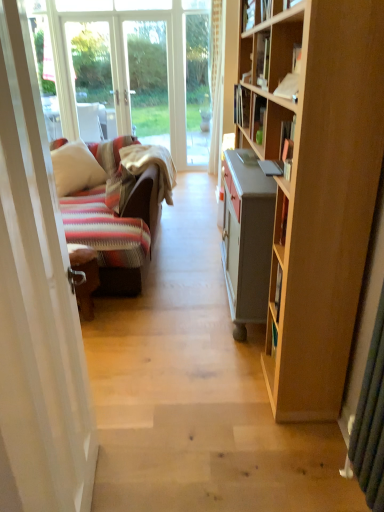
Where is `matte black book at upper center, which is the 1th book from front to back`? matte black book at upper center, which is the 1th book from front to back is located at coordinates (262, 59).

At what (x,y) coordinates should I click in order to perform the action: click on hardcover book at upper right, the 1th book positioned from the back. Please return your answer as a coordinate pair (x, y). Looking at the image, I should click on (241, 106).

What do you see at coordinates (75, 168) in the screenshot? Image resolution: width=384 pixels, height=512 pixels. I see `white soft pillow at left, marked as the second pillow in a right-to-left arrangement` at bounding box center [75, 168].

This screenshot has width=384, height=512. In order to click on white glossy door at left in this screenshot , I will do `click(37, 306)`.

From the image's perspective, is striped fabric pillow at left, which appears as the 1th pillow when viewed from the right, over matte black book at upper center, which is the 1th book from front to back?

Incorrect, from the image's perspective, striped fabric pillow at left, which appears as the 1th pillow when viewed from the right, is lower than matte black book at upper center, which is the 1th book from front to back.

Is striped fabric pillow at left, which appears as the 1th pillow when viewed from the right, spatially inside matte black book at upper center, which is the 1th book from front to back, or outside of it?

striped fabric pillow at left, which appears as the 1th pillow when viewed from the right, cannot be found inside matte black book at upper center, which is the 1th book from front to back.

In the image, is striped fabric pillow at left, acting as the second pillow starting from the left, positioned in front of or behind matte black book at upper center, which is the 1th book from front to back?

Visually, striped fabric pillow at left, acting as the second pillow starting from the left, is located behind matte black book at upper center, which is the 1th book from front to back.

Is striped fabric pillow at left, acting as the second pillow starting from the left, directly adjacent to matte black book at upper center, which is the 1th book from front to back?

striped fabric pillow at left, acting as the second pillow starting from the left, and matte black book at upper center, which is the 1th book from front to back, are not in contact.

Does white glossy door at left have a larger size compared to white soft pillow at left, marked as the second pillow in a right-to-left arrangement?

Actually, white glossy door at left might be smaller than white soft pillow at left, marked as the second pillow in a right-to-left arrangement.

From a real-world perspective, is white glossy door at left physically below white soft pillow at left, marked as the second pillow in a right-to-left arrangement?

Incorrect, from a real-world perspective, white glossy door at left is higher than white soft pillow at left, marked as the second pillow in a right-to-left arrangement.

Find the location of `the 2nd pillow behind when counting from the white glossy door at left`. the 2nd pillow behind when counting from the white glossy door at left is located at coordinates (75, 168).

Considering the relative sizes of white glossy door at left and white soft pillow at left, marked as the second pillow in a right-to-left arrangement, in the image provided, is white glossy door at left shorter than white soft pillow at left, marked as the second pillow in a right-to-left arrangement,?

Incorrect, the height of white glossy door at left does not fall short of that of white soft pillow at left, marked as the second pillow in a right-to-left arrangement.

Considering the positions of points (256, 48) and (235, 98), is point (256, 48) farther from camera compared to point (235, 98)?

No, it is not.

Is matte black book at upper center, positioned as the second book in back-to-front order, aimed at hardcover book at upper right, the 1th book positioned from the back?

No, matte black book at upper center, positioned as the second book in back-to-front order, does not turn towards hardcover book at upper right, the 1th book positioned from the back.

The width and height of the screenshot is (384, 512). Identify the location of book behind the matte black book at upper center, positioned as the second book in back-to-front order. (241, 106).

Is white glossy door at left inside striped fabric pillow at left, acting as the second pillow starting from the left?

No, white glossy door at left is not a part of striped fabric pillow at left, acting as the second pillow starting from the left.

In terms of height, does striped fabric pillow at left, which appears as the 1th pillow when viewed from the right, look taller or shorter compared to white glossy door at left?

Considering their sizes, striped fabric pillow at left, which appears as the 1th pillow when viewed from the right, has less height than white glossy door at left.

Can you confirm if striped fabric pillow at left, which appears as the 1th pillow when viewed from the right, is bigger than white glossy door at left?

No, striped fabric pillow at left, which appears as the 1th pillow when viewed from the right, is not bigger than white glossy door at left.

From their relative heights in the image, would you say hardcover book at upper right, the 1th book positioned from the back, is taller or shorter than white glossy door at left?

In the image, hardcover book at upper right, the 1th book positioned from the back, appears to be shorter than white glossy door at left.

Consider the image. Can you tell me how much hardcover book at upper right, the second book in the front-to-back sequence, and white glossy door at left differ in facing direction?

The angle between the facing direction of hardcover book at upper right, the second book in the front-to-back sequence, and the facing direction of white glossy door at left is 172 degrees.

Where is `the 1st book to the right of the white glossy door at left, starting your count from the anchor`? the 1st book to the right of the white glossy door at left, starting your count from the anchor is located at coordinates (241, 106).

Does hardcover book at upper right, the second book in the front-to-back sequence, contain white glossy door at left?

No, white glossy door at left is not surrounded by hardcover book at upper right, the second book in the front-to-back sequence.

Is the position of white soft pillow at left, which appears as the 1th pillow when viewed from the left, more distant than that of white glossy door at left?

Yes, white soft pillow at left, which appears as the 1th pillow when viewed from the left, is behind white glossy door at left.

How different are the orientations of white soft pillow at left, marked as the second pillow in a right-to-left arrangement, and white glossy door at left in degrees?

There is a 74.7-degree angle between the facing directions of white soft pillow at left, marked as the second pillow in a right-to-left arrangement, and white glossy door at left.

Is white soft pillow at left, marked as the second pillow in a right-to-left arrangement, taller than white glossy door at left?

In fact, white soft pillow at left, marked as the second pillow in a right-to-left arrangement, may be shorter than white glossy door at left.

From a real-world perspective, which is physically below, white soft pillow at left, which appears as the 1th pillow when viewed from the left, or white glossy door at left?

white soft pillow at left, which appears as the 1th pillow when viewed from the left.

Does hardcover book at upper right, the second book in the front-to-back sequence, contain matte black book at upper center, which is the 1th book from front to back?

No, hardcover book at upper right, the second book in the front-to-back sequence, does not contain matte black book at upper center, which is the 1th book from front to back.

Can you confirm if hardcover book at upper right, the 1th book positioned from the back, is wider than matte black book at upper center, positioned as the second book in back-to-front order?

Indeed, hardcover book at upper right, the 1th book positioned from the back, has a greater width compared to matte black book at upper center, positioned as the second book in back-to-front order.

Considering the relative positions of hardcover book at upper right, the second book in the front-to-back sequence, and matte black book at upper center, positioned as the second book in back-to-front order, in the image provided, is hardcover book at upper right, the second book in the front-to-back sequence, to the left of matte black book at upper center, positioned as the second book in back-to-front order, from the viewer's perspective?

Indeed, hardcover book at upper right, the second book in the front-to-back sequence, is positioned on the left side of matte black book at upper center, positioned as the second book in back-to-front order.

This screenshot has width=384, height=512. I want to click on book that appears above the hardcover book at upper right, the 1th book positioned from the back (from a real-world perspective), so click(262, 59).

From the image's perspective, count 2nd books upward from the striped fabric pillow at left, acting as the second pillow starting from the left, and point to it. Please provide its 2D coordinates.

[(262, 59)]

What are the coordinates of `door that is in front of the white soft pillow at left, which appears as the 1th pillow when viewed from the left` in the screenshot? It's located at click(x=37, y=306).

Consider the image. Based on their spatial positions, is striped fabric pillow at left, acting as the second pillow starting from the left, or white glossy door at left closer to matte black book at upper center, positioned as the second book in back-to-front order?

striped fabric pillow at left, acting as the second pillow starting from the left, is positioned closer to the anchor matte black book at upper center, positioned as the second book in back-to-front order.

When comparing their distances from white glossy door at left, does hardcover book at upper right, the second book in the front-to-back sequence, or matte black book at upper center, which is the 1th book from front to back, seem closer?

Based on the image, matte black book at upper center, which is the 1th book from front to back, appears to be nearer to white glossy door at left.

In the scene shown: Considering their positions, is white soft pillow at left, which appears as the 1th pillow when viewed from the left, positioned closer to hardcover book at upper right, the 1th book positioned from the back, than matte black book at upper center, which is the 1th book from front to back?

Based on the image, matte black book at upper center, which is the 1th book from front to back, appears to be nearer to hardcover book at upper right, the 1th book positioned from the back.

Which object lies further to the anchor point matte black book at upper center, which is the 1th book from front to back, striped fabric pillow at left, which appears as the 1th pillow when viewed from the right, or hardcover book at upper right, the 1th book positioned from the back?

The object further to matte black book at upper center, which is the 1th book from front to back, is striped fabric pillow at left, which appears as the 1th pillow when viewed from the right.

Considering their positions, is hardcover book at upper right, the 1th book positioned from the back, positioned closer to matte black book at upper center, positioned as the second book in back-to-front order, than white soft pillow at left, which appears as the 1th pillow when viewed from the left?

hardcover book at upper right, the 1th book positioned from the back, is closer to matte black book at upper center, positioned as the second book in back-to-front order.

Estimate the real-world distances between objects in this image. Which object is further from matte black book at upper center, which is the 1th book from front to back, white glossy door at left or striped fabric pillow at left, acting as the second pillow starting from the left?

Among the two, white glossy door at left is located further to matte black book at upper center, which is the 1th book from front to back.

Consider the image. When comparing their distances from white glossy door at left, does hardcover book at upper right, the second book in the front-to-back sequence, or striped fabric pillow at left, which appears as the 1th pillow when viewed from the right, seem closer?

Among the two, striped fabric pillow at left, which appears as the 1th pillow when viewed from the right, is located nearer to white glossy door at left.

Looking at the image, which one is located closer to striped fabric pillow at left, acting as the second pillow starting from the left, hardcover book at upper right, the 1th book positioned from the back, or white glossy door at left?

hardcover book at upper right, the 1th book positioned from the back, is positioned closer to the anchor striped fabric pillow at left, acting as the second pillow starting from the left.

Locate an element on the screen. pillow between white glossy door at left and white soft pillow at left, marked as the second pillow in a right-to-left arrangement, in the front-back direction is located at coordinates (119, 189).

You are a GUI agent. You are given a task and a screenshot of the screen. Output one action in this format:
    pyautogui.click(x=<x>, y=<y>)
    Task: Click on the book situated between white soft pillow at left, marked as the second pillow in a right-to-left arrangement, and matte black book at upper center, which is the 1th book from front to back, from left to right
    This screenshot has width=384, height=512.
    Given the screenshot: What is the action you would take?
    pyautogui.click(x=241, y=106)

The width and height of the screenshot is (384, 512). Identify the location of book between white glossy door at left and hardcover book at upper right, the second book in the front-to-back sequence, along the z-axis. (262, 59).

Locate an element on the screen. The image size is (384, 512). pillow located between white soft pillow at left, which appears as the 1th pillow when viewed from the left, and matte black book at upper center, which is the 1th book from front to back, in the left-right direction is located at coordinates (119, 189).